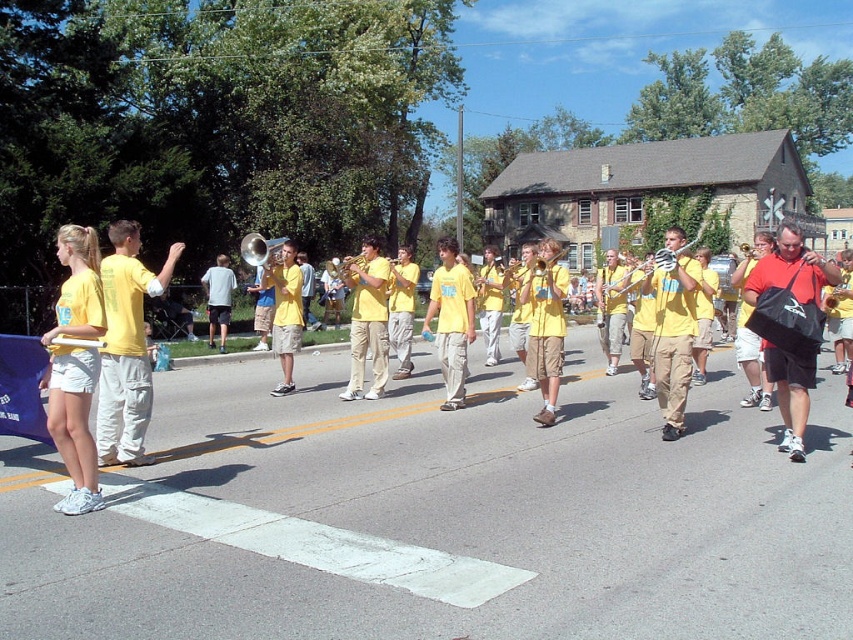
Is point (84, 236) farther from camera compared to point (126, 426)?

That is False.

Consider the image. Can you confirm if yellow matte uniform at left is shorter than yellow matte t-shirt at left?

Incorrect, yellow matte uniform at left's height does not fall short of yellow matte t-shirt at left's.

What do you see at coordinates (74, 442) in the screenshot? The image size is (853, 640). I see `yellow matte uniform at left` at bounding box center [74, 442].

You are a GUI agent. You are given a task and a screenshot of the screen. Output one action in this format:
    pyautogui.click(x=<x>, y=<y>)
    Task: Click on the yellow matte uniform at left
    
    Given the screenshot: What is the action you would take?
    pyautogui.click(x=74, y=442)

Can you confirm if yellow matte uniform at left is wider than light yellow t-shirt at left?

Indeed, yellow matte uniform at left has a greater width compared to light yellow t-shirt at left.

Where is `yellow matte uniform at left`? This screenshot has height=640, width=853. yellow matte uniform at left is located at coordinates (74, 442).

At what (x,y) coordinates should I click in order to perform the action: click on yellow matte uniform at left. Please return your answer as a coordinate pair (x, y). Looking at the image, I should click on (74, 442).

Can you confirm if yellow matte t-shirt at left is smaller than khaki pants at center?

Yes.

What do you see at coordinates (126, 346) in the screenshot?
I see `yellow matte t-shirt at left` at bounding box center [126, 346].

Who is more distant from viewer, (x=111, y=433) or (x=676, y=237)?

Positioned behind is point (x=676, y=237).

Find the location of a particular element. The width and height of the screenshot is (853, 640). yellow matte t-shirt at left is located at coordinates (126, 346).